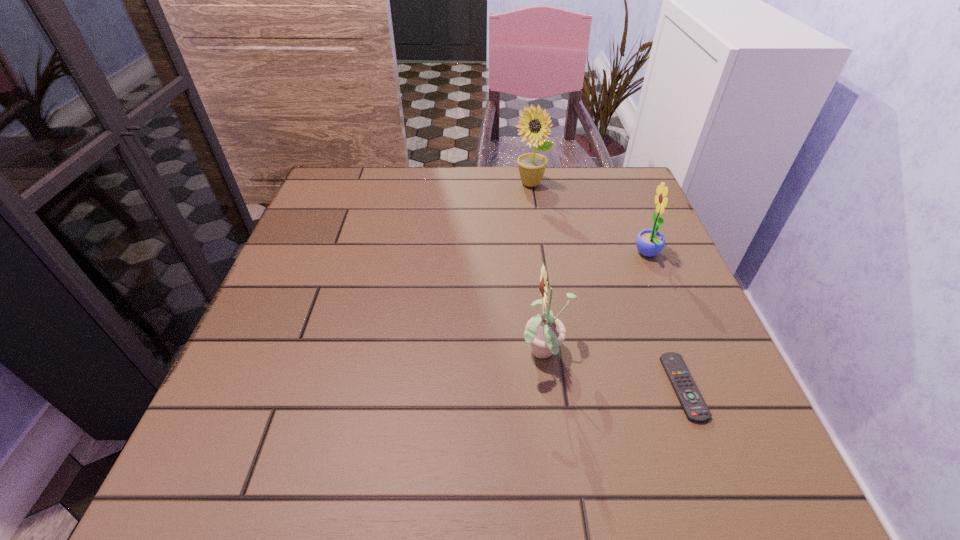
Where is `the farthest sunflower`? the farthest sunflower is located at coordinates (532, 166).

Locate an element on the screen. The image size is (960, 540). the nearest sunflower is located at coordinates click(545, 333).

The image size is (960, 540). Find the location of `the second farthest object`. the second farthest object is located at coordinates (649, 242).

Image resolution: width=960 pixels, height=540 pixels. I want to click on the rightmost sunflower, so click(x=649, y=242).

You are a GUI agent. You are given a task and a screenshot of the screen. Output one action in this format:
    pyautogui.click(x=<x>, y=<y>)
    Task: Click on the shortest object
    
    Given the screenshot: What is the action you would take?
    pyautogui.click(x=696, y=410)

This screenshot has height=540, width=960. I want to click on vacant space located 0.200m on the face of the farthest object, so click(x=539, y=241).

The height and width of the screenshot is (540, 960). What are the coordinates of `free location located on the front-facing side of the nearest sunflower` in the screenshot? It's located at (451, 354).

Find the location of a particular element. This screenshot has height=540, width=960. vacant space located 0.370m on the front-facing side of the nearest sunflower is located at coordinates (310, 354).

Find the location of a particular element. This screenshot has height=540, width=960. free point located 0.120m on the front-facing side of the nearest sunflower is located at coordinates (451, 354).

Locate an element on the screen. This screenshot has width=960, height=540. free space located 0.070m on the front-facing side of the rightmost sunflower is located at coordinates (603, 254).